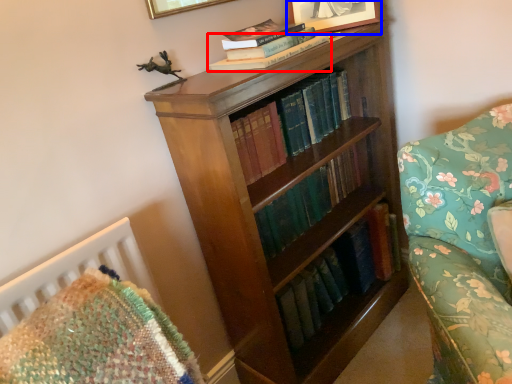
Question: Which point is closer to the camera, book (highlighted by a red box) or picture frame (highlighted by a blue box)?

Choices:
 (A) book
 (B) picture frame

Answer: (A)